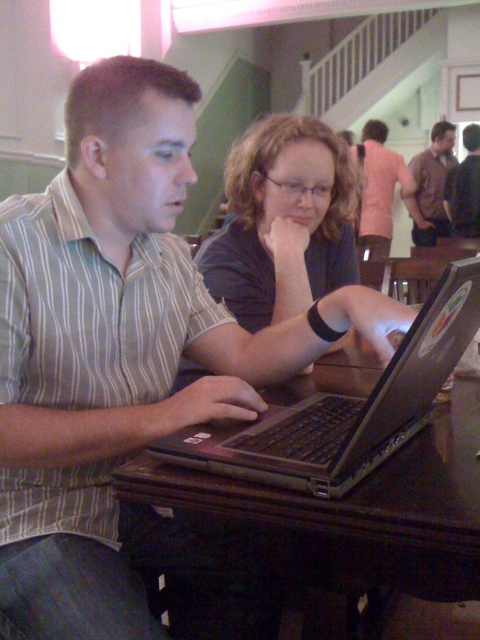
You are a delivery person who just arrived at the location shown in the image. You need to place a small package on the table exactly where the silver metallic laptop at center is located. According to the coordinates provided, what are the coordinates where you should place the package?

The coordinates for the silver metallic laptop at center are point (344, 408), so you should place the package at those coordinates.

You are standing in front of the brown wooden table at center and the matte black shirt at center. Which object is nearer to you?

The brown wooden table at center is closer to the viewer than the matte black shirt at center, so the brown wooden table at center is nearer to you.

From the picture: You are a photographer standing behind the brown wooden table at center and the pink fabric shirt at upper center. Which object is closer to you?

The brown wooden table at center is closer to you since it is in front of the pink fabric shirt at upper center.